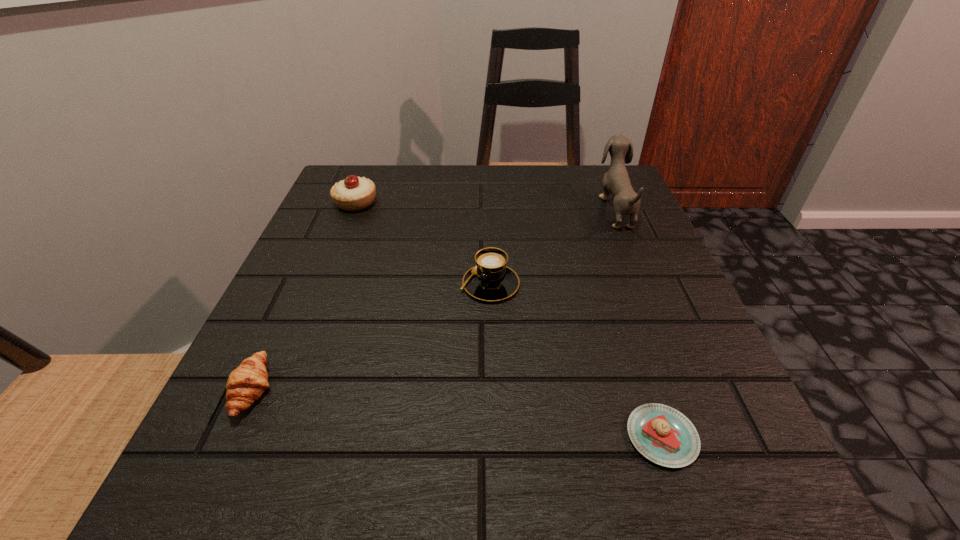
Identify the location of object at the far left corner. The image size is (960, 540). (354, 193).

This screenshot has height=540, width=960. In order to click on object present at the far right corner in this screenshot , I will do `click(616, 181)`.

Locate an element on the screen. object positioned at the near right corner is located at coordinates (662, 434).

At what (x,y) coordinates should I click in order to perform the action: click on vacant area at the far edge. Please return your answer as a coordinate pair (x, y). The image size is (960, 540). Looking at the image, I should click on (469, 170).

Find the location of a particular element. free region at the near edge is located at coordinates (491, 504).

The height and width of the screenshot is (540, 960). Identify the location of vacant area at the left edge. (292, 304).

In the image, there is a desktop. Where is `vacant space at the right edge`? This screenshot has width=960, height=540. vacant space at the right edge is located at coordinates [x=601, y=313].

In order to click on free region at the far left corner in this screenshot , I will do `click(391, 167)`.

Where is `vacant space at the near left corner of the desktop`? The width and height of the screenshot is (960, 540). vacant space at the near left corner of the desktop is located at coordinates (171, 511).

Find the location of a particular element. The image size is (960, 540). vacant area at the far right corner of the desktop is located at coordinates (572, 208).